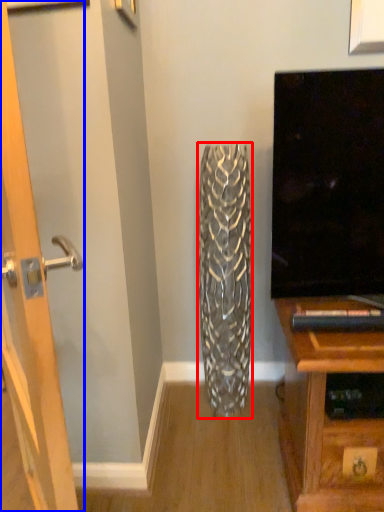
Question: Which object is closer to the camera taking this photo, vase (highlighted by a red box) or door (highlighted by a blue box)?

Choices:
 (A) vase
 (B) door

Answer: (B)